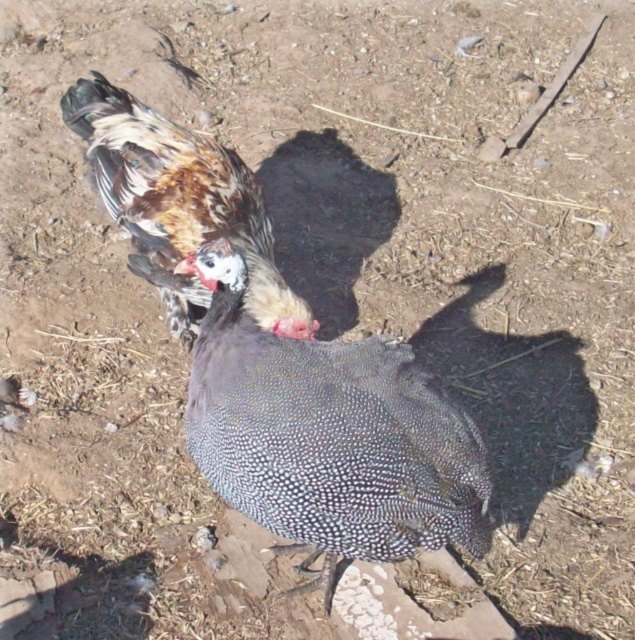
Can you confirm if white speckled feather at center is positioned above speckled feathered chicken at center?

No.

Between white speckled feather at center and speckled feathered chicken at center, which one has less height?

Standing shorter between the two is speckled feathered chicken at center.

Locate an element on the screen. Image resolution: width=635 pixels, height=640 pixels. white speckled feather at center is located at coordinates (328, 436).

Image resolution: width=635 pixels, height=640 pixels. I want to click on white speckled feather at center, so click(x=328, y=436).